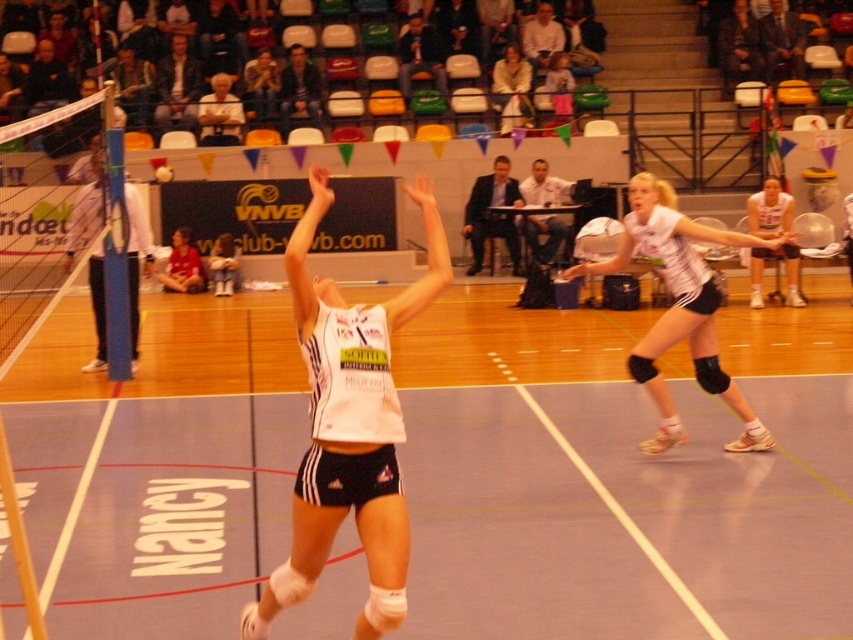
Can you confirm if white matte jersey at center is positioned below white mesh net at left?

Correct, white matte jersey at center is located below white mesh net at left.

Which is in front, point (347, 314) or point (25, 129)?

Point (347, 314) is in front.

Which is behind, point (363, 433) or point (50, 236)?

The point (50, 236) is more distant.

Image resolution: width=853 pixels, height=640 pixels. I want to click on white matte jersey at center, so click(349, 426).

Between smooth wooden floor at center and white matte uniform at center, which one is positioned lower?

Positioned lower is smooth wooden floor at center.

Does smooth wooden floor at center have a lesser height compared to white matte uniform at center?

Yes.

This screenshot has height=640, width=853. What do you see at coordinates (622, 476) in the screenshot? I see `smooth wooden floor at center` at bounding box center [622, 476].

Identify the location of smooth wooden floor at center. (622, 476).

Can you confirm if smooth wooden floor at center is positioned to the right of white mesh net at left?

Correct, you'll find smooth wooden floor at center to the right of white mesh net at left.

Who is more forward, [113,461] or [55,195]?

Point [113,461] is in front.

What do you see at coordinates (622, 476) in the screenshot? This screenshot has height=640, width=853. I see `smooth wooden floor at center` at bounding box center [622, 476].

In order to click on smooth wooden floor at center in this screenshot , I will do `click(622, 476)`.